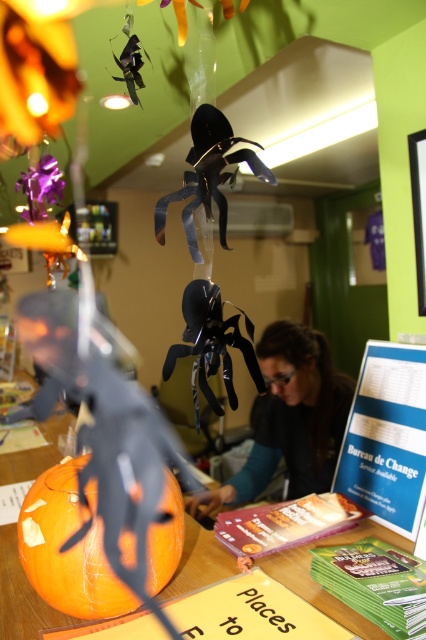
You are planning to place a new Halloween decoration in the center of the table where the matte black spider at center and orange carved pumpkin at center are currently located. Which object should you move to make space, considering their sizes?

The matte black spider at center is larger in size than the orange carved pumpkin at center, so you should move the matte black spider at center to make space for the new decoration.

You are standing in front of the orange matte pumpkin at center and want to place a small Halloween decoration on the table next to it. If the decoration is 12 inches tall, will it fit on the table without being too close to the pumpkin?

The orange matte pumpkin at center is 28.17 inches from the viewer. The distance between the pumpkin and the decoration would need to be at least 12 inches to accommodate the decoration. Since the pumpkin is 28.17 inches away, there is sufficient space to place the decoration next to it without being too close.